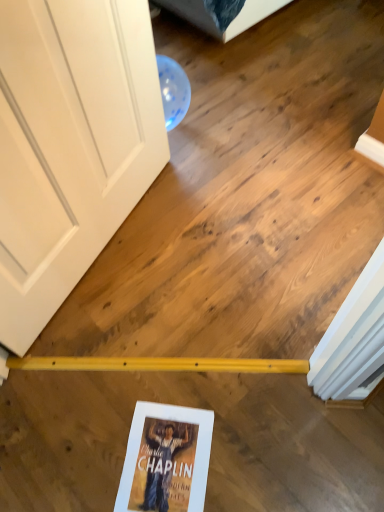
In order to face white matte door at upper left, should I rotate leftwards or rightwards?

Turn left by 16.480 degrees to look at white matte door at upper left.

This screenshot has width=384, height=512. What are the coordinates of `white matte door at upper left` in the screenshot? It's located at (70, 145).

Describe the element at coordinates (70, 145) in the screenshot. The image size is (384, 512). I see `white matte door at upper left` at that location.

The height and width of the screenshot is (512, 384). Describe the element at coordinates (166, 459) in the screenshot. I see `hardcover book at lower center` at that location.

You are a GUI agent. You are given a task and a screenshot of the screen. Output one action in this format:
    pyautogui.click(x=<x>, y=<y>)
    Task: Click on the hardcover book at lower center
    
    Given the screenshot: What is the action you would take?
    pyautogui.click(x=166, y=459)

Locate an element on the screen. white matte door at upper left is located at coordinates [70, 145].

Looking at this image, would you say white matte door at upper left is to the left or to the right of hardcover book at lower center in the picture?

white matte door at upper left is to the left of hardcover book at lower center.

In the image, is white matte door at upper left positioned in front of or behind hardcover book at lower center?

Visually, white matte door at upper left is located in front of hardcover book at lower center.

Which point is more distant from viewer, (77, 226) or (154, 492)?

Point (77, 226)

From the image's perspective, which one is positioned lower, white matte door at upper left or hardcover book at lower center?

hardcover book at lower center, from the image's perspective.

From a real-world perspective, is white matte door at upper left located beneath hardcover book at lower center?

No, from a real-world perspective, white matte door at upper left is not below hardcover book at lower center.

Which object is wider, white matte door at upper left or hardcover book at lower center?

hardcover book at lower center is wider.

Does white matte door at upper left have a lesser height compared to hardcover book at lower center?

In fact, white matte door at upper left may be taller than hardcover book at lower center.

Considering the relative sizes of white matte door at upper left and hardcover book at lower center in the image provided, is white matte door at upper left smaller than hardcover book at lower center?

Actually, white matte door at upper left might be larger than hardcover book at lower center.

Is hardcover book at lower center surrounded by white matte door at upper left?

No, hardcover book at lower center is not a part of white matte door at upper left.

Is white matte door at upper left not close to hardcover book at lower center?

They are positioned close to each other.

Is white matte door at upper left facing towards hardcover book at lower center?

Yes, white matte door at upper left is oriented towards hardcover book at lower center.

Locate an element on the screen. paperback book that is on the right side of white matte door at upper left is located at coordinates (166, 459).

Between hardcover book at lower center and white matte door at upper left, which one appears on the right side from the viewer's perspective?

Positioned to the right is hardcover book at lower center.

Is the depth of hardcover book at lower center less than that of white matte door at upper left?

No, the depth of hardcover book at lower center is greater than that of white matte door at upper left.

Considering the positions of point (202, 440) and point (131, 207), is point (202, 440) closer or farther from the camera than point (131, 207)?

Point (202, 440) is positioned closer to the camera compared to point (131, 207).

From the image's perspective, is hardcover book at lower center over white matte door at upper left?

No, from the image's perspective, hardcover book at lower center is not over white matte door at upper left.

From a real-world perspective, between hardcover book at lower center and white matte door at upper left, who is vertically higher?

From a 3D spatial view, white matte door at upper left is above.

Which of these two, hardcover book at lower center or white matte door at upper left, is wider?

With larger width is hardcover book at lower center.

Can you confirm if hardcover book at lower center is shorter than white matte door at upper left?

Yes, hardcover book at lower center is shorter than white matte door at upper left.

Is hardcover book at lower center bigger than white matte door at upper left?

No.

Looking at this image, is hardcover book at lower center inside the boundaries of white matte door at upper left, or outside?

hardcover book at lower center is spatially situated outside white matte door at upper left.

Is hardcover book at lower center positioned far away from white matte door at upper left?

hardcover book at lower center is actually quite close to white matte door at upper left.

Is white matte door at upper left at the back of hardcover book at lower center?

No.

Can you tell me how much hardcover book at lower center and white matte door at upper left differ in facing direction?

hardcover book at lower center and white matte door at upper left are facing 66.1 degrees away from each other.

The width and height of the screenshot is (384, 512). I want to click on paperback book behind the white matte door at upper left, so click(166, 459).

Identify the location of paperback book lying below the white matte door at upper left (from the image's perspective). The image size is (384, 512). (166, 459).

Image resolution: width=384 pixels, height=512 pixels. I want to click on door lying in front of the hardcover book at lower center, so click(x=70, y=145).